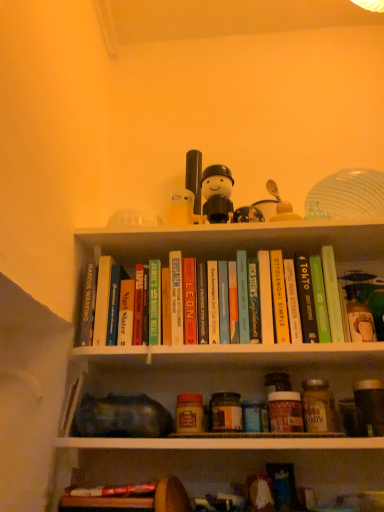
Question: Is green matte book at upper right, which is the 9th paperback book in left-to-right order, positioned beyond the bounds of hardcover book at center, arranged as the fifth paperback book when viewed from the right?

Choices:
 (A) yes
 (B) no

Answer: (A)

Question: From the image's perspective, is green matte book at upper right, which is the 9th paperback book in left-to-right order, located beneath hardcover book at center, which is the 6th paperback book from left to right?

Choices:
 (A) no
 (B) yes

Answer: (B)

Question: Is green matte book at upper right, which appears as the 2th paperback book when viewed from the right, looking in the opposite direction of hardcover book at center, arranged as the fifth paperback book when viewed from the right?

Choices:
 (A) yes
 (B) no

Answer: (B)

Question: Considering the relative sizes of green matte book at upper right, which appears as the 2th paperback book when viewed from the right, and hardcover book at center, which is the 6th paperback book from left to right, in the image provided, is green matte book at upper right, which appears as the 2th paperback book when viewed from the right, wider than hardcover book at center, which is the 6th paperback book from left to right,?

Choices:
 (A) no
 (B) yes

Answer: (B)

Question: Is green matte book at upper right, which appears as the 2th paperback book when viewed from the right, positioned in front of hardcover book at center, which is the 6th paperback book from left to right?

Choices:
 (A) yes
 (B) no

Answer: (B)

Question: Is green matte book at upper right, which appears as the 2th paperback book when viewed from the right, surrounding hardcover book at center, arranged as the fifth paperback book when viewed from the right?

Choices:
 (A) yes
 (B) no

Answer: (B)

Question: Is hardcover book at center, marked as the second paperback book in a left-to-right arrangement, oriented away from hardcover book at center, which appears as the 6th paperback book when viewed from the right?

Choices:
 (A) yes
 (B) no

Answer: (B)

Question: Is the depth of hardcover book at center, which ranks as the ninth paperback book in right-to-left order, less than that of hardcover book at center, which appears as the 6th paperback book when viewed from the right?

Choices:
 (A) yes
 (B) no

Answer: (B)

Question: Does hardcover book at center, marked as the second paperback book in a left-to-right arrangement, turn towards hardcover book at center, which appears as the 6th paperback book when viewed from the right?

Choices:
 (A) yes
 (B) no

Answer: (B)

Question: Is hardcover book at center, which ranks as the ninth paperback book in right-to-left order, bigger than hardcover book at center, the 5th paperback book viewed from the left?

Choices:
 (A) yes
 (B) no

Answer: (A)

Question: Are hardcover book at center, which ranks as the ninth paperback book in right-to-left order, and hardcover book at center, which appears as the 6th paperback book when viewed from the right, located far from each other?

Choices:
 (A) yes
 (B) no

Answer: (B)

Question: Considering the relative positions of hardcover book at center, which ranks as the ninth paperback book in right-to-left order, and hardcover book at center, which appears as the 6th paperback book when viewed from the right, in the image provided, is hardcover book at center, which ranks as the ninth paperback book in right-to-left order, to the right of hardcover book at center, which appears as the 6th paperback book when viewed from the right, from the viewer's perspective?

Choices:
 (A) yes
 (B) no

Answer: (B)

Question: Can we say hardcover book at upper center, positioned as the 7th paperback book in left-to-right order, lies outside hardcover book at upper center, the third paperback book when ordered from right to left?

Choices:
 (A) yes
 (B) no

Answer: (A)